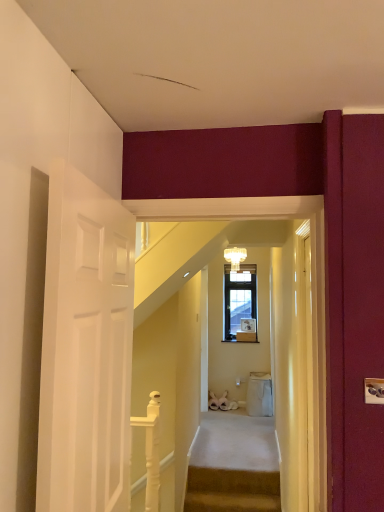
The image size is (384, 512). What are the coordinates of `empty space that is ontop of carpeted stairs at center, positioned as the 1th stairs in bottom-to-top order` in the screenshot? It's located at (236, 495).